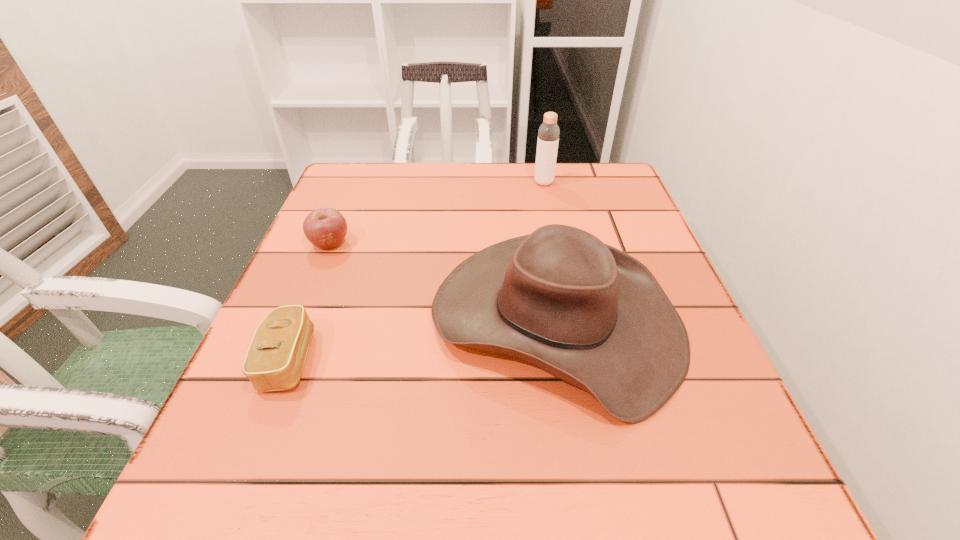
What are the coordinates of `free space between the apple and the cowboy hat` in the screenshot? It's located at (443, 281).

This screenshot has width=960, height=540. Identify the location of vacant space that's between the second tallest object and the apple. (443, 281).

At what (x,y) coordinates should I click in order to perform the action: click on free space between the clutch bag and the apple. Please return your answer as a coordinate pair (x, y). Looking at the image, I should click on (309, 301).

At what (x,y) coordinates should I click in order to perform the action: click on empty location between the bottle and the apple. Please return your answer as a coordinate pair (x, y). This screenshot has height=540, width=960. Looking at the image, I should click on (437, 213).

Identify the location of vacant space that's between the bottle and the clutch bag. The width and height of the screenshot is (960, 540). (416, 271).

This screenshot has width=960, height=540. I want to click on vacant area that lies between the bottle and the apple, so click(437, 213).

This screenshot has height=540, width=960. I want to click on object that ranks as the second closest to the cowboy hat, so click(x=325, y=228).

Identify which object is located as the nearest to the tallest object. Please provide its 2D coordinates. Your answer should be formatted as a tuple, i.e. [(x, y)], where the tuple contains the x and y coordinates of a point satisfying the conditions above.

[(585, 312)]

This screenshot has width=960, height=540. Identify the location of vacant space that satisfies the following two spatial constraints: 1. on the side of the apple with the unique marking; 2. on the right side of the second tallest object. (300, 319).

Locate an element on the screen. free space that satisfies the following two spatial constraints: 1. on the side of the third shortest object with the unique marking; 2. on the right side of the apple is located at coordinates tap(300, 319).